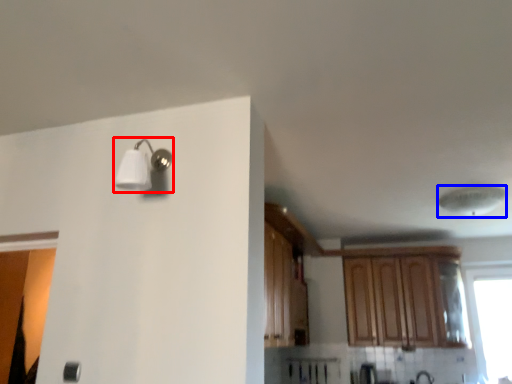
Question: Which object is further to the camera taking this photo, light fixture (highlighted by a red box) or lamp (highlighted by a blue box)?

Choices:
 (A) light fixture
 (B) lamp

Answer: (B)